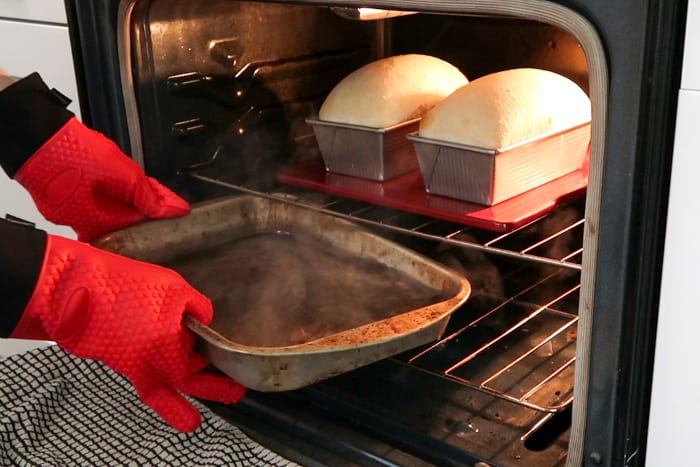
Where is `tray`? tray is located at coordinates (491, 189).